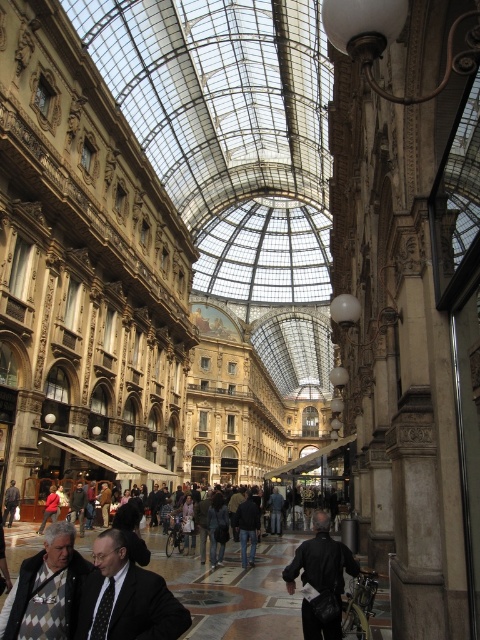
Question: Can you confirm if dark gray suit at center is smaller than red matte jacket at lower left?

Choices:
 (A) yes
 (B) no

Answer: (B)

Question: Can you confirm if dark gray suit at center is positioned below red matte jacket at lower left?

Choices:
 (A) yes
 (B) no

Answer: (B)

Question: Among these points, which one is farthest from the camera?

Choices:
 (A) (307, 579)
 (B) (16, 504)

Answer: (B)

Question: Is knitted sweater at lower left thinner than dark gray jacket at center?

Choices:
 (A) yes
 (B) no

Answer: (B)

Question: Which object appears closest to the camera in this image?

Choices:
 (A) red matte jacket at lower left
 (B) dark brown leather jacket at center
 (C) dark gray suit at center
 (D) dark gray jacket at center

Answer: (C)

Question: Which point appears farthest from the camera in this image?

Choices:
 (A) (20, 572)
 (B) (2, 515)
 (C) (111, 589)

Answer: (B)